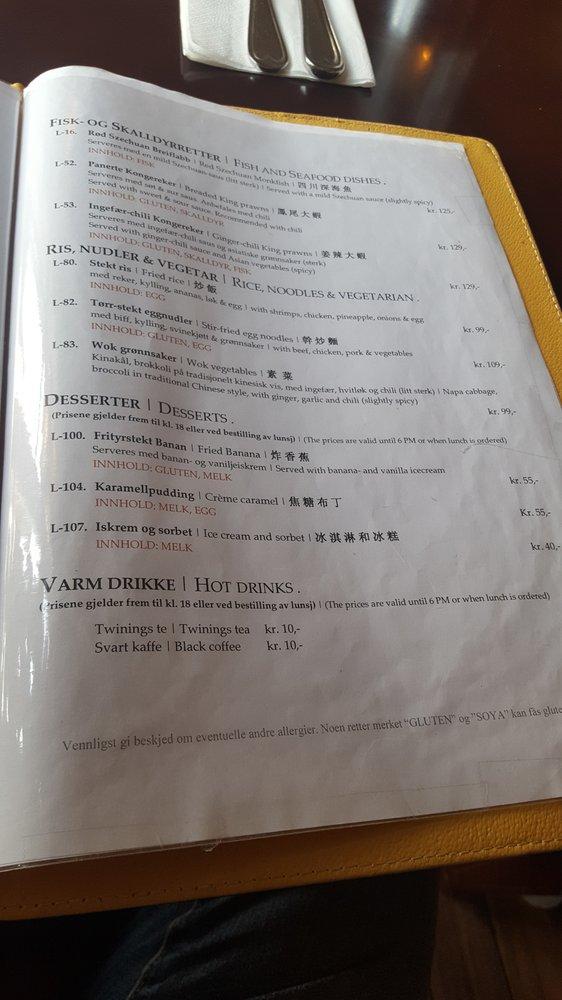
Locate an element on the screen. Image resolution: width=562 pixels, height=1000 pixels. wood table is located at coordinates (490, 66).